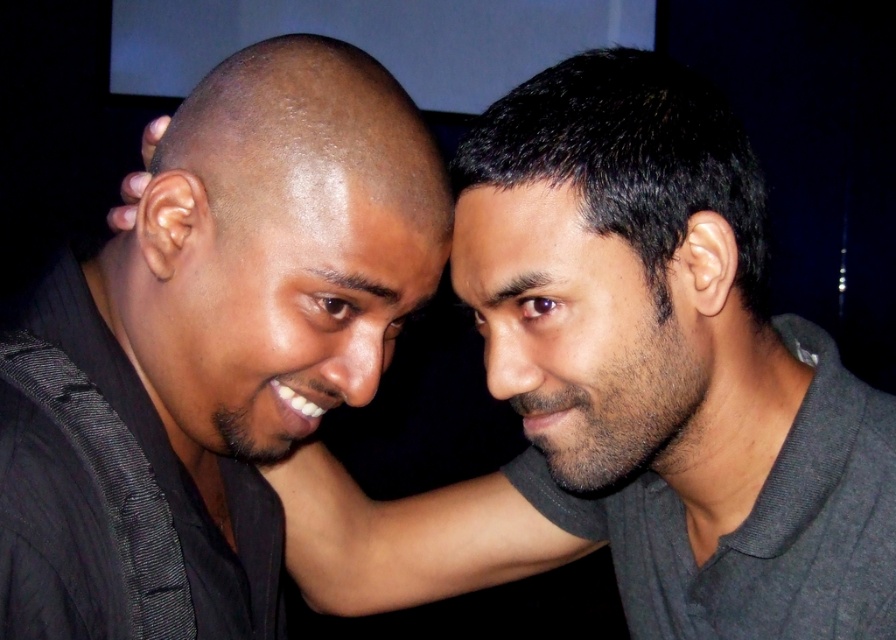
Does black matte shirt at left have a lesser height compared to smooth skin at center?

No, black matte shirt at left is not shorter than smooth skin at center.

Between point (164, 340) and point (360, 577), which one is positioned in front?

Positioned in front is point (164, 340).

Where is `black matte shirt at left`? The width and height of the screenshot is (896, 640). black matte shirt at left is located at coordinates (211, 348).

Who is higher up, smooth black shirt at left or black matte shirt at left?

Positioned higher is black matte shirt at left.

Between point (497, 202) and point (377, 269), which one is positioned in front?

Point (377, 269) is more forward.

Locate an element on the screen. The height and width of the screenshot is (640, 896). smooth black shirt at left is located at coordinates (629, 387).

From the picture: Who is more forward, (x=683, y=288) or (x=464, y=572)?

Point (x=683, y=288) is in front.

Does smooth black shirt at left have a larger size compared to smooth skin at center?

Yes, smooth black shirt at left is bigger than smooth skin at center.

Find the location of `smooth black shirt at left`. smooth black shirt at left is located at coordinates (629, 387).